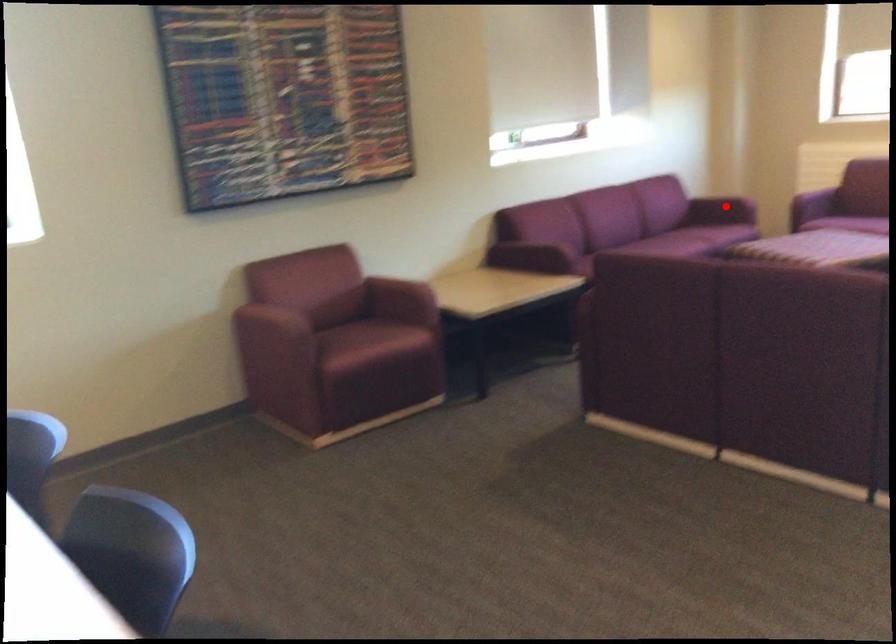
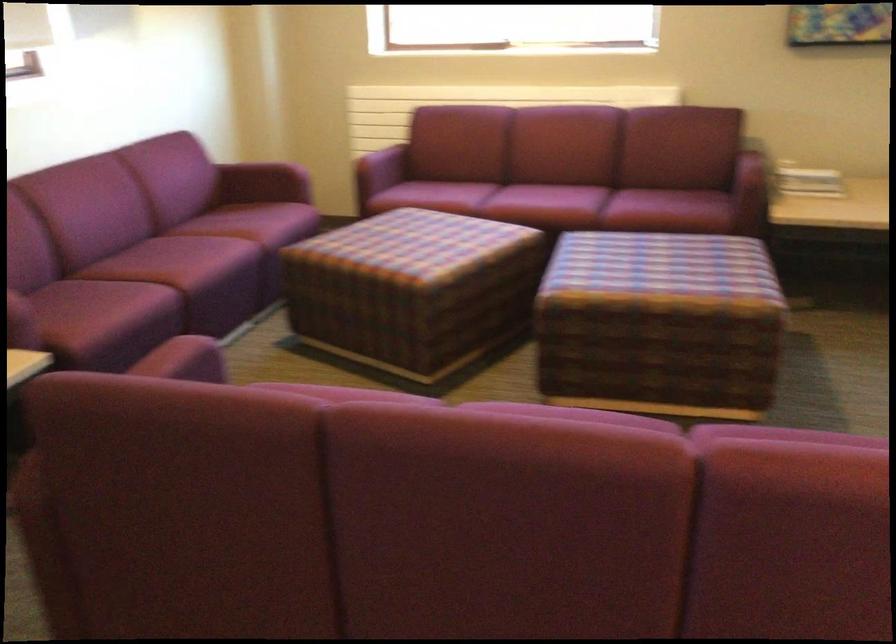
Where in the second image is the point corresponding to the highlighted location from the first image?

(269, 173)